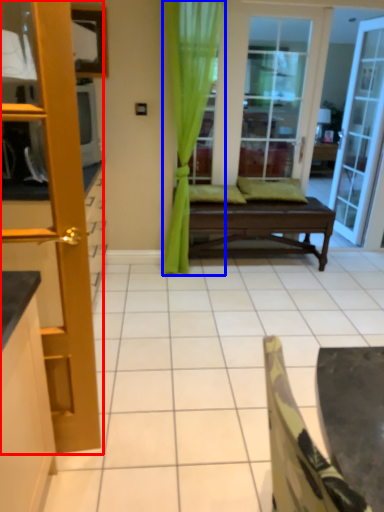
Question: Which of the following is the closest to the observer, door (highlighted by a red box) or curtain (highlighted by a blue box)?

Choices:
 (A) door
 (B) curtain

Answer: (A)